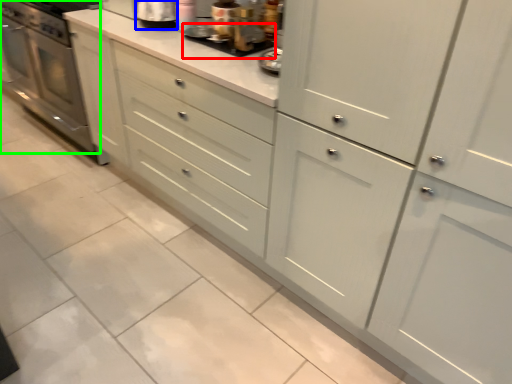
Question: Which object is positioned closest to appliance (highlighted by a red box)? Select from appliance (highlighted by a blue box) and home appliance (highlighted by a green box).

Choices:
 (A) appliance
 (B) home appliance

Answer: (A)